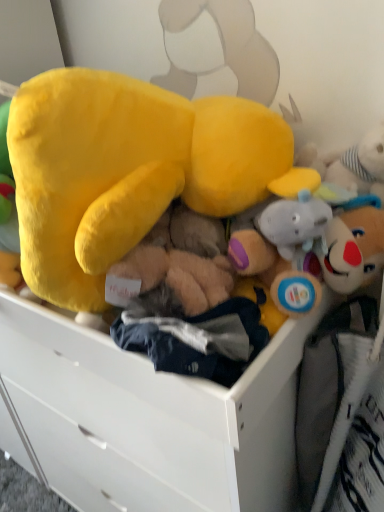
Question: Which is correct: fluffy yellow plush at center is inside white matte drawer at center, or outside of it?

Choices:
 (A) inside
 (B) outside

Answer: (B)

Question: Considering the positions of fluffy yellow plush at center and white matte drawer at center in the image, is fluffy yellow plush at center taller or shorter than white matte drawer at center?

Choices:
 (A) short
 (B) tall

Answer: (A)

Question: From the image's perspective, is fluffy yellow plush at center positioned above or below white matte drawer at center?

Choices:
 (A) above
 (B) below

Answer: (A)

Question: Is white matte drawer at center to the left or to the right of fluffy yellow plush at center in the image?

Choices:
 (A) left
 (B) right

Answer: (B)

Question: From their relative heights in the image, would you say white matte drawer at center is taller or shorter than fluffy yellow plush at center?

Choices:
 (A) tall
 (B) short

Answer: (A)

Question: Is white matte drawer at center inside the boundaries of fluffy yellow plush at center, or outside?

Choices:
 (A) inside
 (B) outside

Answer: (B)

Question: In terms of width, does white matte drawer at center look wider or thinner when compared to fluffy yellow plush at center?

Choices:
 (A) thin
 (B) wide

Answer: (B)